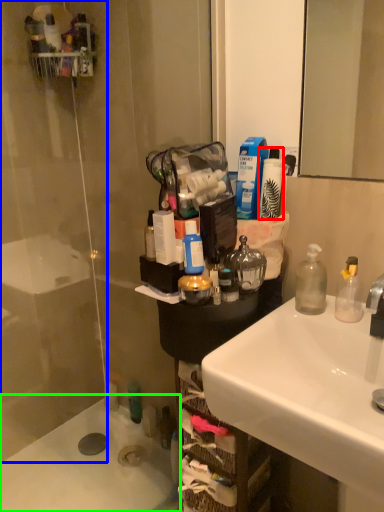
Question: Estimate the real-world distances between objects in this image. Which object is farther from toiletry (highlighted by a red box), glass door (highlighted by a blue box) or bath (highlighted by a green box)?

Choices:
 (A) glass door
 (B) bath

Answer: (B)